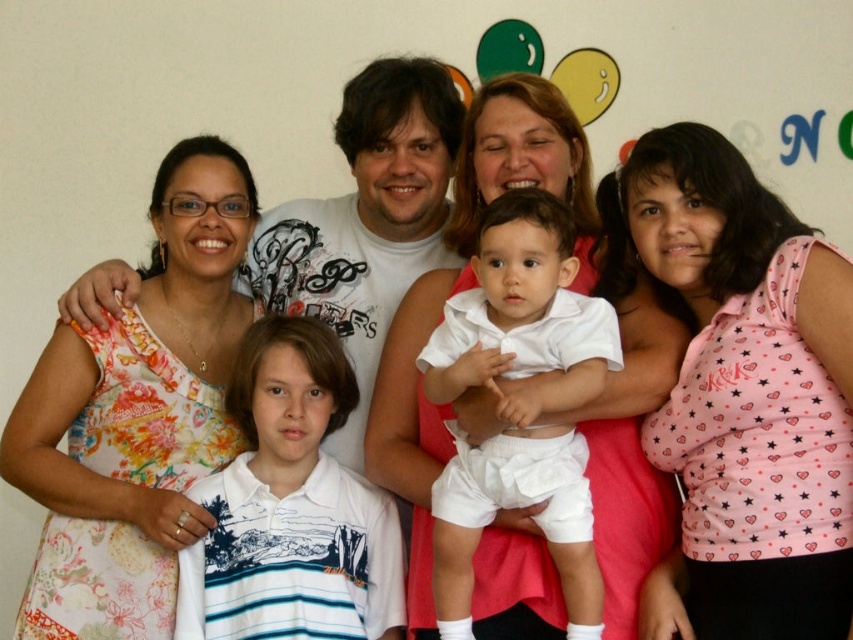
In the scene shown: Who is taller, floral dress at left or white matte shirt at upper center?

Standing taller between the two is floral dress at left.

Is point (117, 394) positioned behind point (267, 296)?

No, it is not.

Between point (164, 170) and point (410, 246), which one is positioned behind?

Point (410, 246)

Identify the location of floral dress at left. (136, 416).

Who is shorter, floral dress at left or white smooth baby at center?

white smooth baby at center

Consider the image. Is floral dress at left further to camera compared to white smooth baby at center?

Yes, floral dress at left is further from the viewer.

Identify the location of floral dress at left. [x=136, y=416].

Can you confirm if floral dress at left is positioned below white cotton baby at center?

No.

Does floral dress at left have a smaller size compared to white cotton baby at center?

No, floral dress at left is not smaller than white cotton baby at center.

Does point (224, 321) come farther from viewer compared to point (277, 516)?

Yes, point (224, 321) is farther from viewer.

This screenshot has width=853, height=640. I want to click on floral dress at left, so click(x=136, y=416).